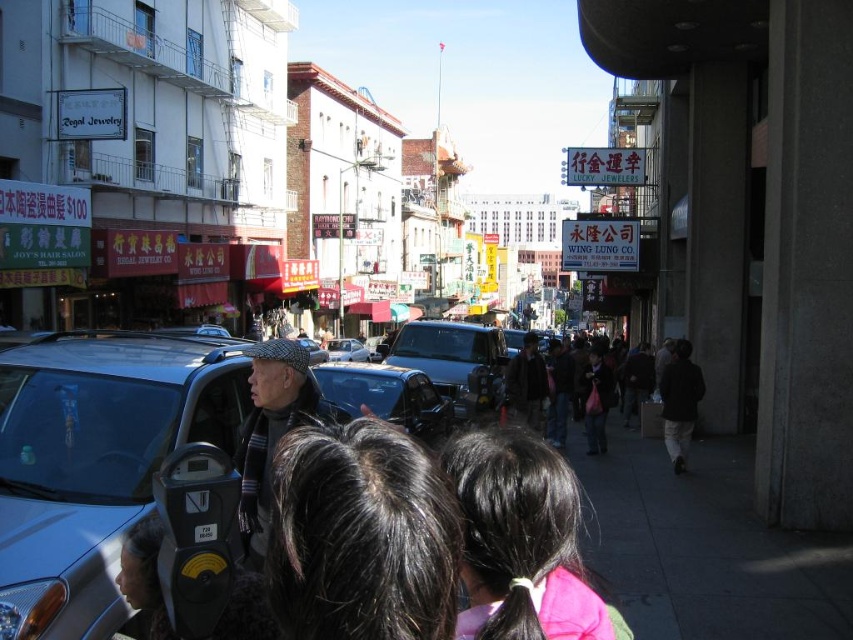
Question: Among these points, which one is farthest from the camera?

Choices:
 (A) pos(520,349)
 (B) pos(596,381)
 (C) pos(556,520)
 (D) pos(654,608)

Answer: (A)

Question: Based on their relative distances, which object is nearer to the silver metallic car at center?

Choices:
 (A) black plastic parking meter at lower left
 (B) dark gray clothing at center
 (C) shiny blue car at center

Answer: (C)

Question: Does black hair at center have a larger size compared to black plastic parking meter at lower left?

Choices:
 (A) no
 (B) yes

Answer: (B)

Question: Among these objects, which one is nearest to the camera?

Choices:
 (A) gray concrete sidewalk at lower right
 (B) dark brown hair at center
 (C) metallic blue taxi at center

Answer: (B)

Question: Is shiny blue car at center wider than dark gray clothing at center?

Choices:
 (A) no
 (B) yes

Answer: (B)

Question: Does black hair at center have a smaller size compared to black plastic parking meter at lower left?

Choices:
 (A) yes
 (B) no

Answer: (B)